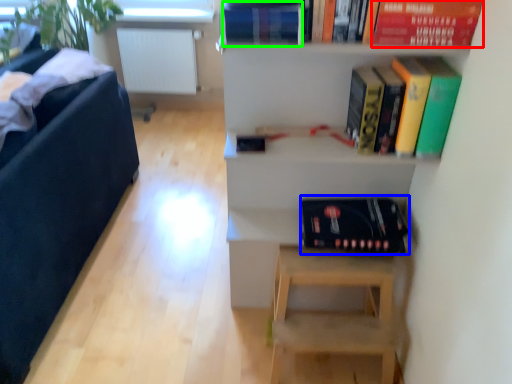
Question: Which object is the farthest from paperback book (highlighted by a red box)? Choose among these: album (highlighted by a blue box) or paperback book (highlighted by a green box).

Choices:
 (A) album
 (B) paperback book

Answer: (A)